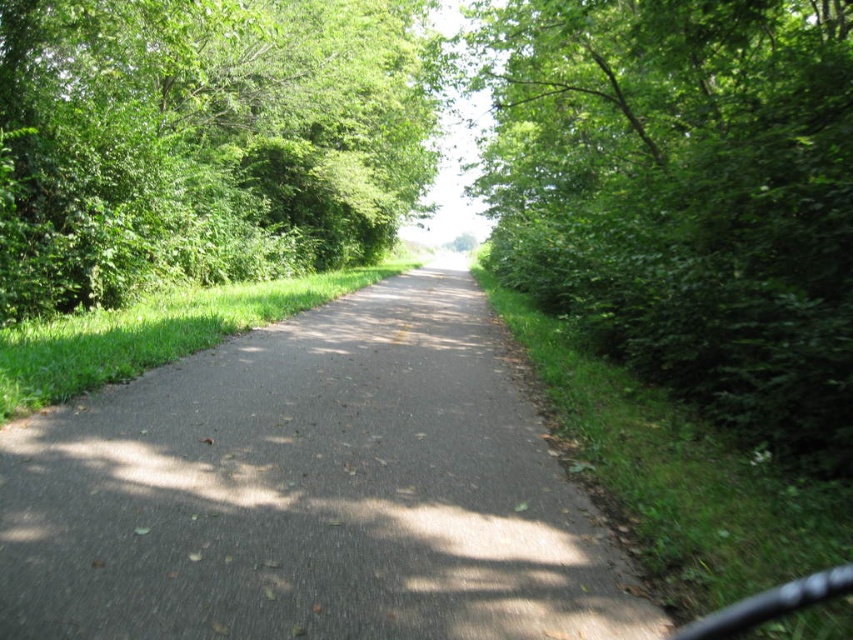
Question: Which object appears farthest from the camera in this image?

Choices:
 (A) green leafy tree at right
 (B) green leafy tree at upper left
 (C) smooth asphalt road at center

Answer: (B)

Question: Considering the real-world distances, which object is farthest from the green leafy tree at right?

Choices:
 (A) green leafy tree at upper left
 (B) smooth asphalt road at center

Answer: (B)

Question: Does smooth asphalt road at center have a greater width compared to green leafy tree at upper left?

Choices:
 (A) yes
 (B) no

Answer: (B)

Question: Is smooth asphalt road at center above green leafy tree at right?

Choices:
 (A) yes
 (B) no

Answer: (B)

Question: Does smooth asphalt road at center have a lesser width compared to green leafy tree at upper left?

Choices:
 (A) yes
 (B) no

Answer: (A)

Question: Which is farther from the smooth asphalt road at center?

Choices:
 (A) green leafy tree at upper left
 (B) green leafy tree at right

Answer: (A)